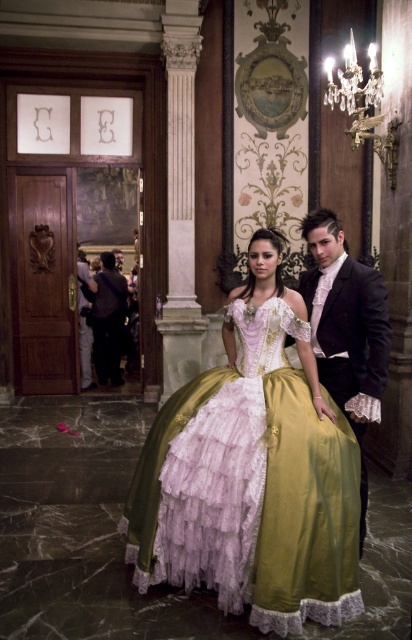
Question: Which object is farther from the camera taking this photo?

Choices:
 (A) lavender satin gown at center
 (B) dark purple fabric at left
 (C) shiny black suit at center

Answer: (B)

Question: Which of these objects is positioned farthest from the lavender satin gown at center?

Choices:
 (A) dark purple fabric at left
 (B) shiny black suit at center

Answer: (A)

Question: Considering the relative positions of lavender satin gown at center and shiny black suit at center in the image provided, where is lavender satin gown at center located with respect to shiny black suit at center?

Choices:
 (A) below
 (B) above

Answer: (A)

Question: Is lavender satin gown at center bigger than dark purple fabric at left?

Choices:
 (A) yes
 (B) no

Answer: (A)

Question: Which object is farther from the camera taking this photo?

Choices:
 (A) dark purple fabric at left
 (B) lavender satin gown at center
 (C) shiny black suit at center

Answer: (A)

Question: Is lavender satin gown at center smaller than dark purple fabric at left?

Choices:
 (A) no
 (B) yes

Answer: (A)